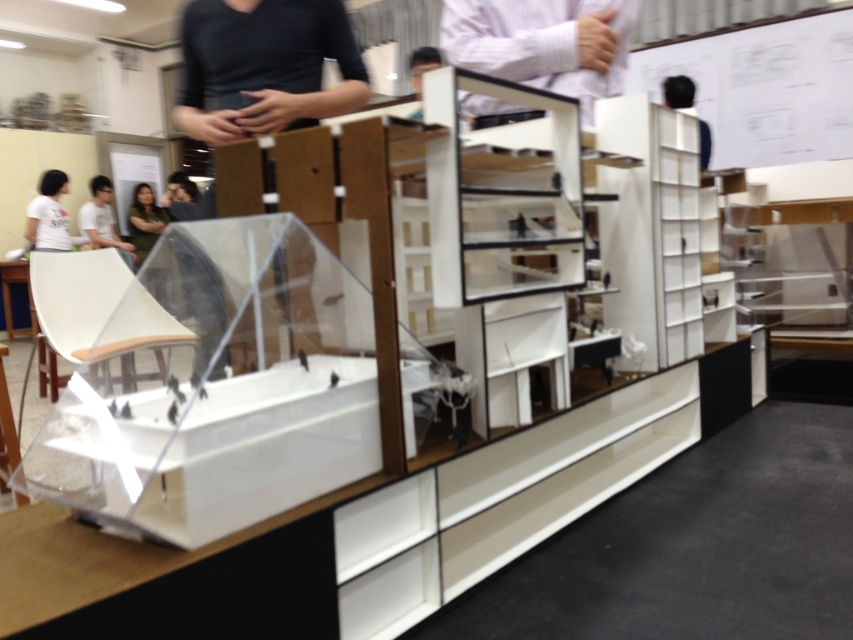
Question: Is green fabric shirt at lower left further to camera compared to black fabric at upper right?

Choices:
 (A) yes
 (B) no

Answer: (A)

Question: Which point is closer to the camera?

Choices:
 (A) green fabric shirt at lower left
 (B) matte black shirt at left
 (C) white striped shirt at upper center

Answer: (C)

Question: Does matte black shirt at left appear on the left side of black fabric at upper right?

Choices:
 (A) yes
 (B) no

Answer: (A)

Question: Among these objects, which one is nearest to the camera?

Choices:
 (A) white striped shirt at upper center
 (B) green fabric shirt at lower left
 (C) matte black shirt at left
 (D) white t-shirt at left

Answer: (A)

Question: Which point is farther to the camera?

Choices:
 (A) black fabric at upper right
 (B) green fabric shirt at lower left
 (C) white t-shirt at left
 (D) white striped shirt at upper center

Answer: (B)

Question: Does matte black shirt at left have a lesser width compared to black fabric at upper right?

Choices:
 (A) yes
 (B) no

Answer: (B)